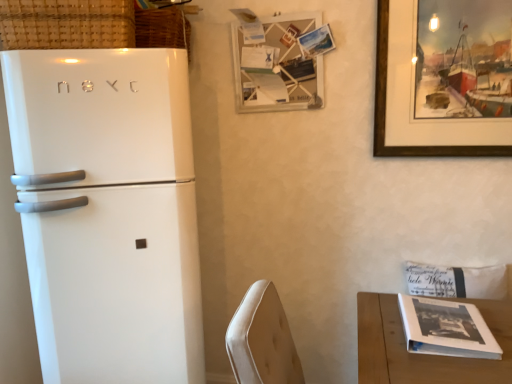
Question: Is wooden framed painting at upper right, the first picture frame viewed from the right, looking in the opposite direction of white glossy refrigerator at left?

Choices:
 (A) yes
 (B) no

Answer: (B)

Question: From a real-world perspective, is wooden framed painting at upper right, acting as the second picture frame starting from the left, located beneath white glossy refrigerator at left?

Choices:
 (A) no
 (B) yes

Answer: (A)

Question: Does wooden framed painting at upper right, the first picture frame viewed from the right, turn towards white glossy refrigerator at left?

Choices:
 (A) yes
 (B) no

Answer: (B)

Question: Does wooden framed painting at upper right, acting as the second picture frame starting from the left, lie behind white glossy refrigerator at left?

Choices:
 (A) no
 (B) yes

Answer: (B)

Question: From a real-world perspective, is wooden framed painting at upper right, acting as the second picture frame starting from the left, positioned over white glossy refrigerator at left based on gravity?

Choices:
 (A) yes
 (B) no

Answer: (A)

Question: Is wooden framed painting at upper right, acting as the second picture frame starting from the left, placed right next to white glossy refrigerator at left?

Choices:
 (A) yes
 (B) no

Answer: (B)

Question: Is the position of white wood table at lower right more distant than that of white glossy refrigerator at left?

Choices:
 (A) yes
 (B) no

Answer: (A)

Question: Does white wood table at lower right lie in front of white glossy refrigerator at left?

Choices:
 (A) no
 (B) yes

Answer: (A)

Question: Is white wood table at lower right looking in the opposite direction of white glossy refrigerator at left?

Choices:
 (A) yes
 (B) no

Answer: (B)

Question: From the image's perspective, does white wood table at lower right appear lower than white glossy refrigerator at left?

Choices:
 (A) yes
 (B) no

Answer: (A)

Question: From a real-world perspective, is white wood table at lower right physically above white glossy refrigerator at left?

Choices:
 (A) no
 (B) yes

Answer: (A)

Question: Is white wood table at lower right at the right side of white glossy refrigerator at left?

Choices:
 (A) yes
 (B) no

Answer: (A)

Question: From a real-world perspective, is wooden picture frame at upper center, the 1th picture frame from the left, on top of wooden framed painting at upper right, the first picture frame viewed from the right?

Choices:
 (A) no
 (B) yes

Answer: (B)